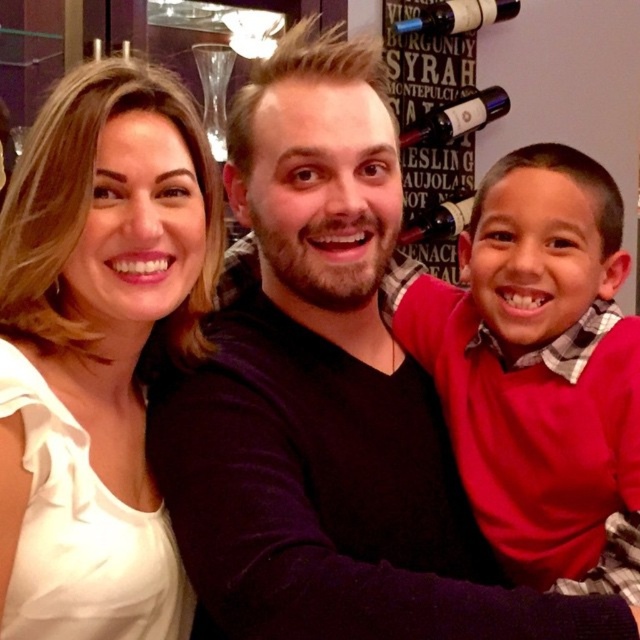
Between point (422, 120) and point (401, 241), which one is positioned behind?

Point (401, 241)

Does matte glass wine bottle at upper right lie behind dark brown glass bottle at center?

No, it is in front of dark brown glass bottle at center.

Who is more forward, [472,106] or [440,237]?

Point [472,106]

Where is `matte glass wine bottle at upper right`? The width and height of the screenshot is (640, 640). matte glass wine bottle at upper right is located at coordinates (456, 118).

Describe the element at coordinates (108, 250) in the screenshot. I see `white satin blouse at upper left` at that location.

Between point (88, 109) and point (451, 212), which one is positioned in front?

Point (88, 109)

What do you see at coordinates (108, 250) in the screenshot? I see `white satin blouse at upper left` at bounding box center [108, 250].

Image resolution: width=640 pixels, height=640 pixels. In order to click on white satin blouse at upper left in this screenshot , I will do `click(108, 250)`.

Can you confirm if white satin blouse at upper left is thinner than matte burgundy wine bottle at upper right?

Yes, white satin blouse at upper left is thinner than matte burgundy wine bottle at upper right.

Does white satin blouse at upper left have a lesser height compared to matte burgundy wine bottle at upper right?

No, white satin blouse at upper left is not shorter than matte burgundy wine bottle at upper right.

Is point (33, 125) closer to viewer compared to point (481, 12)?

Yes, point (33, 125) is closer to viewer.

Locate an element on the screen. white satin blouse at upper left is located at coordinates (108, 250).